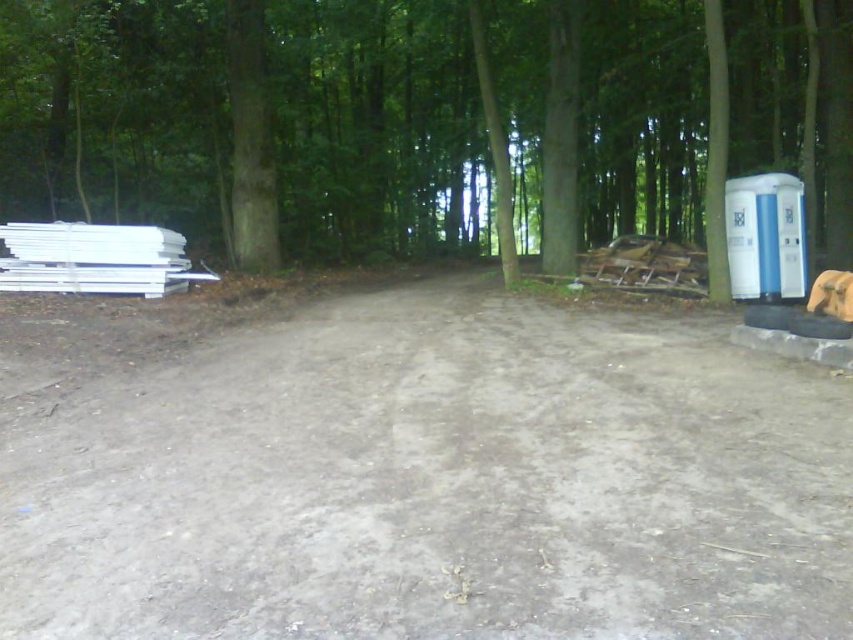
You are hiking along the gray dirt track at center and want to take a photo of the green smooth tree at left. Which direction should you face to capture the tree in your shot?

To capture the green smooth tree at left in your photo, you should face towards the left direction since the gray dirt track at center is in front of the green smooth tree at left, meaning the tree is located behind you as you walk along the track.

From the picture: You are a hiker carrying a 2.5 meter long fishing rod. You need to walk along the gray dirt track at center while avoiding the white plastic water cooler at right. Is there enough space between them for you to pass safely?

The distance between the gray dirt track at center and the white plastic water cooler at right is 2.23 meters. Since the fishing rod is 2.5 meters long, it is longer than the available space, so there isn not enough space to pass safely without risking the fishing rod hitting the water cooler.